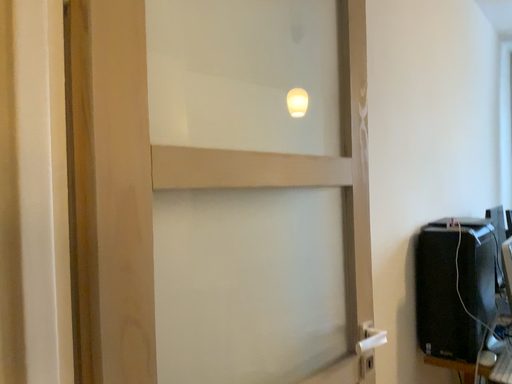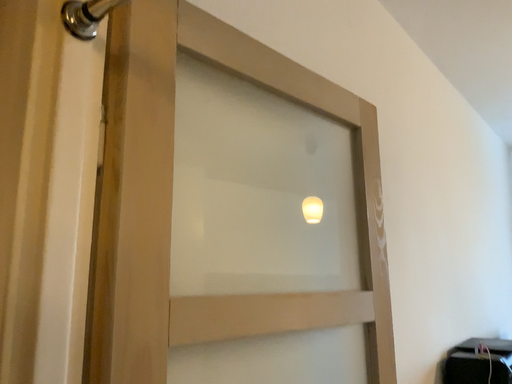
Question: Which way did the camera rotate in the video?

Choices:
 (A) rotated upward
 (B) rotated downward

Answer: (A)